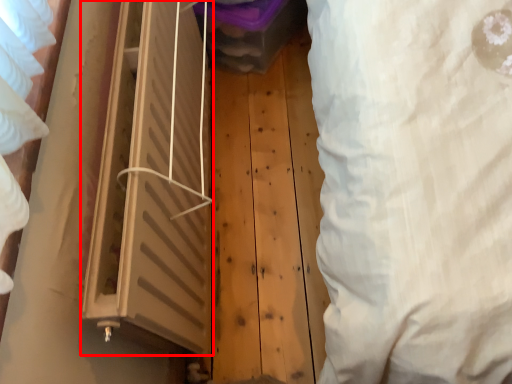
Question: Where is window (annotated by the red box) located in relation to curtain in the image?

Choices:
 (A) left
 (B) right

Answer: (A)